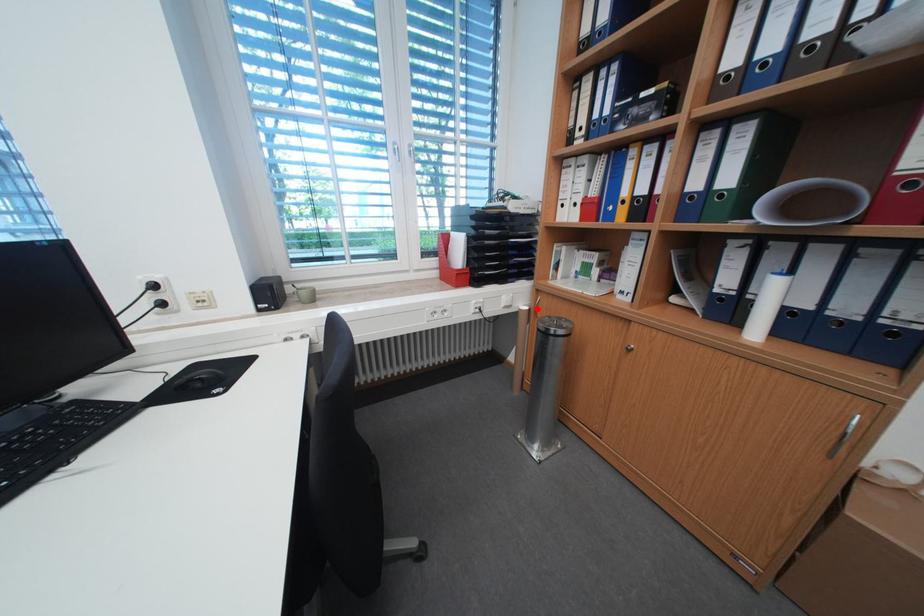
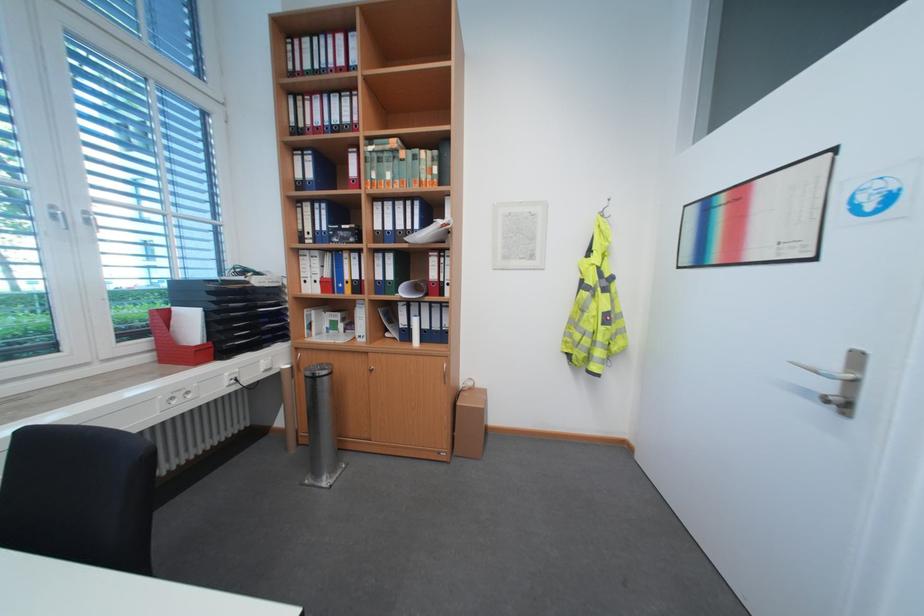
Question: I am providing you with two images of the same scene from different viewpoints. In image1, a red point is highlighted. Considering the same 3D point in image2, which of the following is correct?

Choices:
 (A) It is closer
 (B) It is farther

Answer: (B)